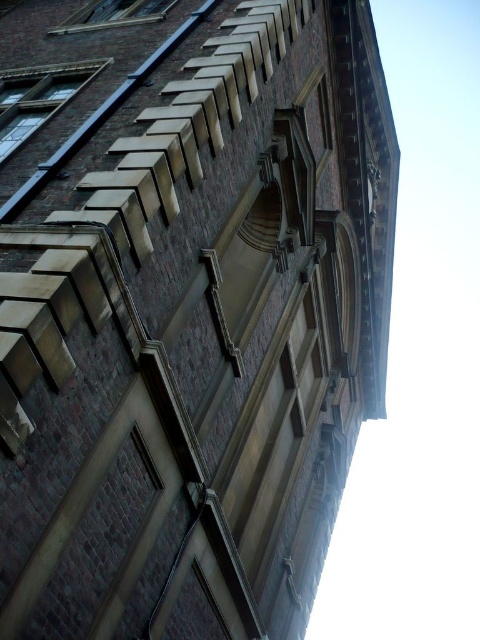
Is matte brick window at upper left further to the viewer compared to clear glass window at upper left?

A: No.

Is point (14, 81) positioned in front of point (62, 33)?

Yes, point (14, 81) is in front of point (62, 33).

Who is more distant from viewer, (13, 124) or (110, 19)?

The point (110, 19) is more distant.

Where is `matte brick window at upper left`? matte brick window at upper left is located at coordinates 37,99.